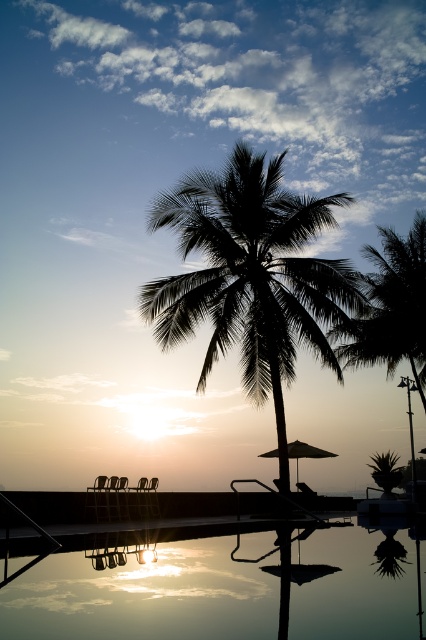
Which is more to the left, silhouette palm tree at center or matte beige umbrella at center?

silhouette palm tree at center is more to the left.

Which is behind, point (207, 314) or point (299, 452)?

The point (299, 452) is more distant.

This screenshot has height=640, width=426. What do you see at coordinates (252, 276) in the screenshot?
I see `silhouette palm tree at center` at bounding box center [252, 276].

Identify the location of silhouette palm tree at center. (252, 276).

Can you confirm if matte beige umbrella at center is positioned to the right of silhouette wooden beach chair at center?

Correct, you'll find matte beige umbrella at center to the right of silhouette wooden beach chair at center.

Can you confirm if matte beige umbrella at center is positioned above silhouette wooden beach chair at center?

Yes, matte beige umbrella at center is above silhouette wooden beach chair at center.

This screenshot has width=426, height=640. Identify the location of matte beige umbrella at center. (305, 452).

The height and width of the screenshot is (640, 426). Describe the element at coordinates (144, 596) in the screenshot. I see `transparent glass water at lower center` at that location.

From the picture: Who is higher up, transparent glass water at lower center or matte beige umbrella at center?

transparent glass water at lower center is above.

Which is behind, point (270, 541) or point (308, 449)?

The point (308, 449) is behind.

Image resolution: width=426 pixels, height=640 pixels. I want to click on transparent glass water at lower center, so click(x=144, y=596).